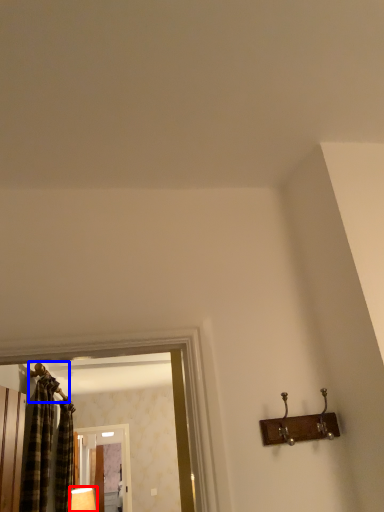
Question: Which object is further to the camera taking this photo, lamp (highlighted by a red box) or hanger (highlighted by a blue box)?

Choices:
 (A) lamp
 (B) hanger

Answer: (A)